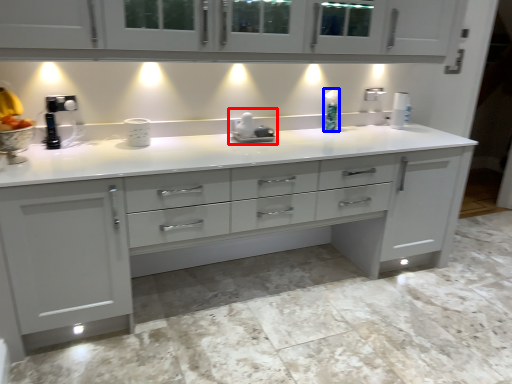
Question: Which of the following is the closest to the observer, appliance (highlighted by a red box) or soap dispenser (highlighted by a blue box)?

Choices:
 (A) appliance
 (B) soap dispenser

Answer: (A)